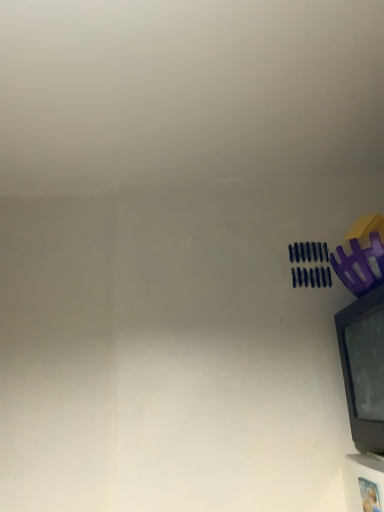
The height and width of the screenshot is (512, 384). In order to click on white glossy picture frame at lower right in this screenshot , I will do click(x=364, y=483).

Describe the element at coordinates (364, 483) in the screenshot. I see `white glossy picture frame at lower right` at that location.

In order to face white glossy picture frame at lower right, should I rotate leftwards or rightwards?

A 22.143 degree turn to the right will do.

What is the approximate width of white glossy picture frame at lower right?

white glossy picture frame at lower right is 2.84 centimeters in width.

Where is `white glossy picture frame at lower right`? white glossy picture frame at lower right is located at coordinates (364, 483).